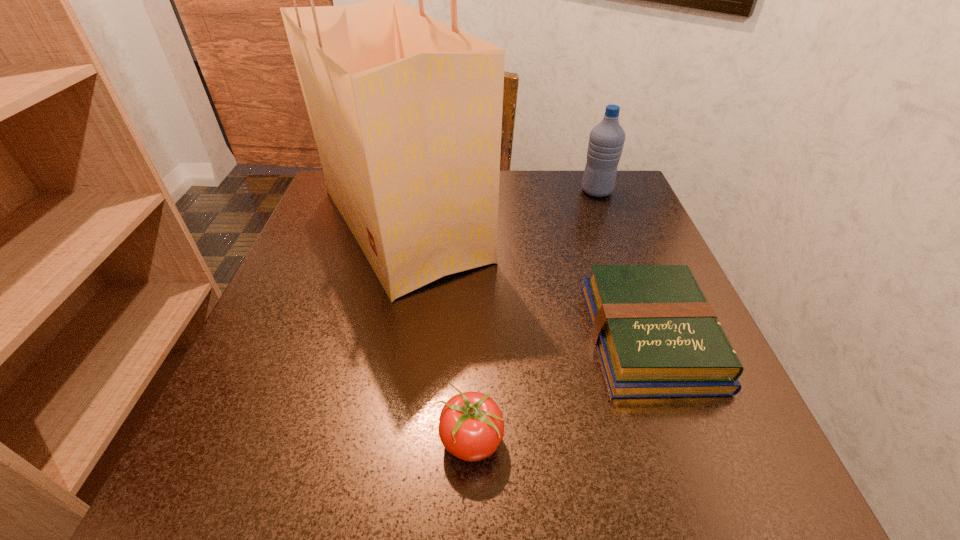
At what (x,y) coordinates should I click in order to perform the action: click on vacant space at the right edge of the desktop. Please return your answer as a coordinate pair (x, y). This screenshot has height=540, width=960. Looking at the image, I should click on point(599,259).

Identify the location of free point at the far left corner. (318, 218).

I want to click on vacant space at the near left corner of the desktop, so click(298, 500).

Locate an element on the screen. vacant space at the far right corner of the desktop is located at coordinates (613, 205).

In the image, there is a desktop. Where is `blank space at the near right corner`? The image size is (960, 540). blank space at the near right corner is located at coordinates (769, 475).

At what (x,y) coordinates should I click in order to perform the action: click on vacant space that is in between the water bottle and the tallest object. Please return your answer as a coordinate pair (x, y). Looking at the image, I should click on (500, 208).

I want to click on empty space between the grocery bag and the nearest object, so click(437, 333).

Where is `vacant area that lies between the book and the third shortest object`? vacant area that lies between the book and the third shortest object is located at coordinates tap(623, 264).

Identify the location of free area in between the tallest object and the water bottle. (500, 208).

Locate an element on the screen. The width and height of the screenshot is (960, 540). vacant space that's between the water bottle and the tomato is located at coordinates pyautogui.click(x=534, y=316).